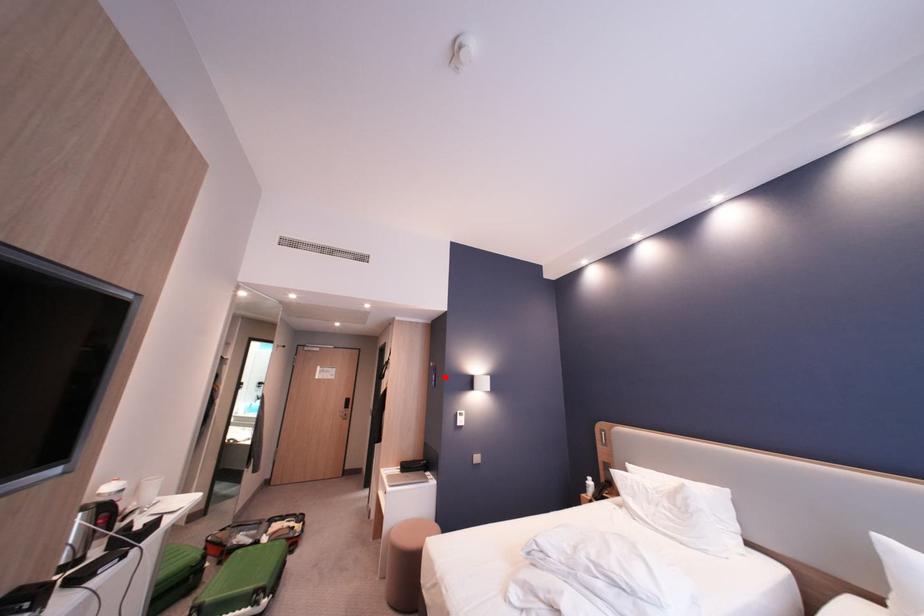
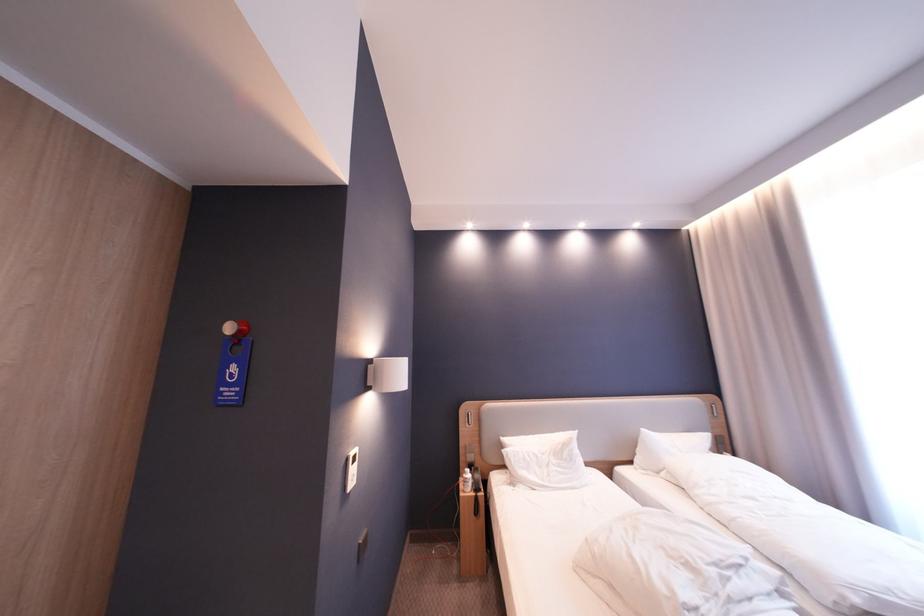
Question: A red point is marked in image1. In image2, is the corresponding 3D point closer to the camera or farther? Reply with the corresponding letter.

Choices:
 (A) The corresponding 3D point is closer.
 (B) The corresponding 3D point is farther.

Answer: (A)